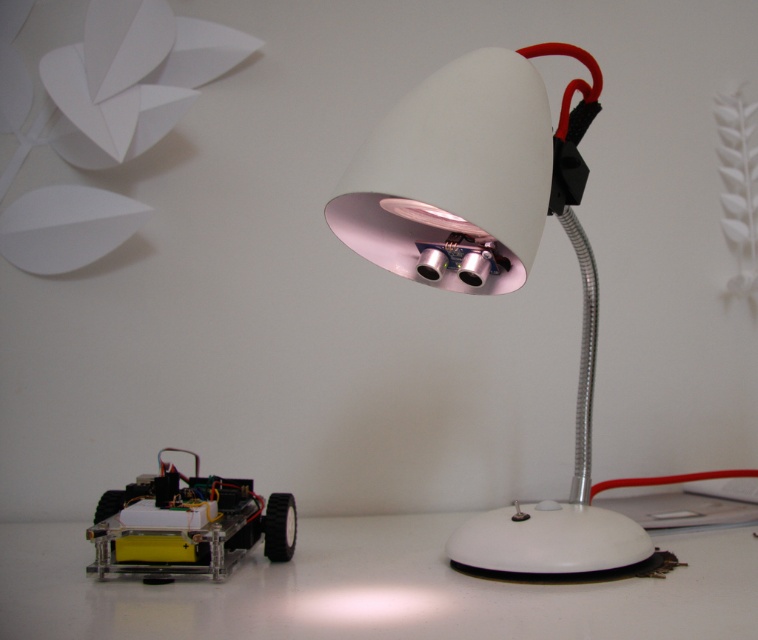
Question: Is white glossy desk lamp at center closer to camera compared to clear acrylic toy car at lower left?

Choices:
 (A) no
 (B) yes

Answer: (B)

Question: Considering the relative positions of white glossy table at lower left and clear acrylic toy car at lower left in the image provided, where is white glossy table at lower left located with respect to clear acrylic toy car at lower left?

Choices:
 (A) left
 (B) right

Answer: (B)

Question: Which point is closer to the camera?

Choices:
 (A) (406, 616)
 (B) (237, 547)

Answer: (A)

Question: Which point is farther to the camera?

Choices:
 (A) white glossy table at lower left
 (B) white glossy desk lamp at center

Answer: (B)

Question: Is white glossy desk lamp at center to the left of clear acrylic toy car at lower left from the viewer's perspective?

Choices:
 (A) yes
 (B) no

Answer: (B)

Question: Estimate the real-world distances between objects in this image. Which object is closer to the clear acrylic toy car at lower left?

Choices:
 (A) white glossy table at lower left
 (B) white glossy desk lamp at center

Answer: (A)